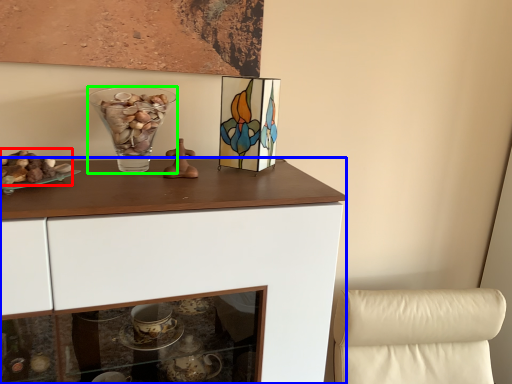
Question: Considering the real-world distances, which object is closest to stuff (highlighted by a red box)? cabinetry (highlighted by a blue box) or vase (highlighted by a green box).

Choices:
 (A) cabinetry
 (B) vase

Answer: (B)